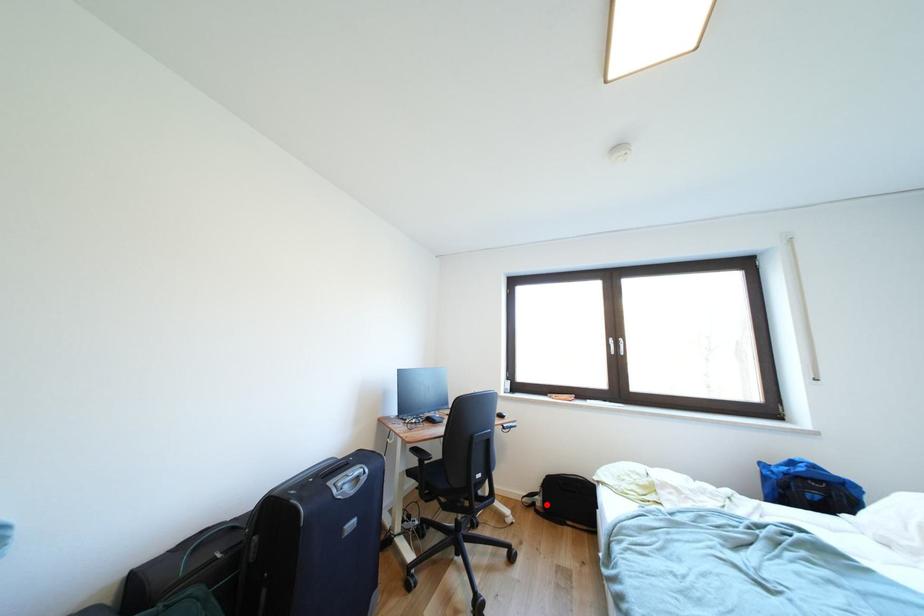
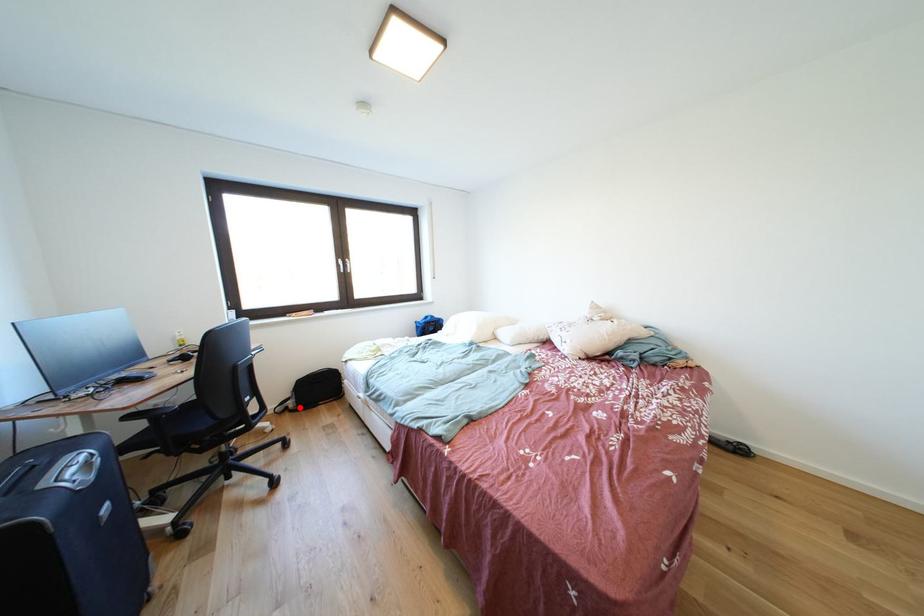
I am providing you with two images of the same scene from different viewpoints. A red point is marked on the first image and another point is marked on the second image. Are the points marked in image1 and image2 representing the same 3D position?

Yes